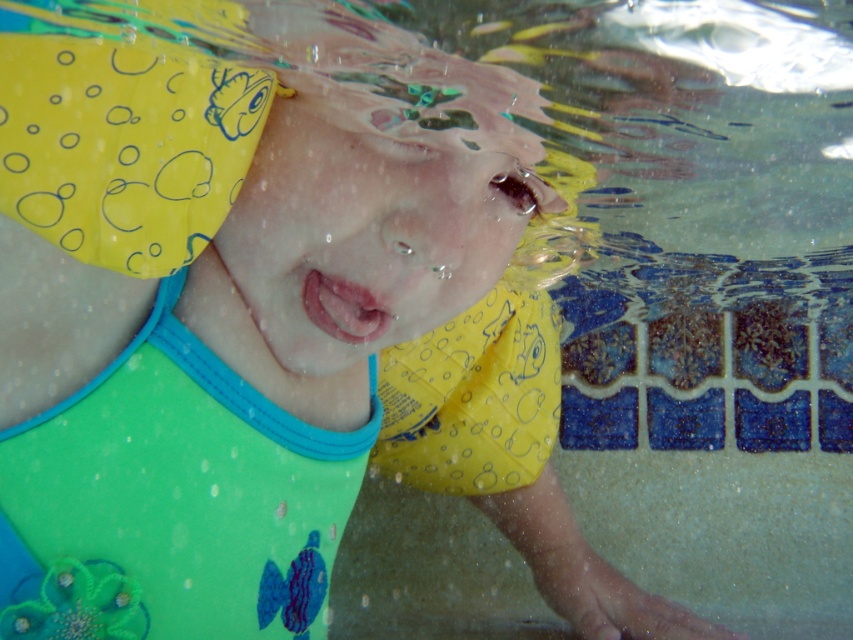
You are a lifeguard assessing the safety gear of a swimmer in the pool. The swimmer has a green fabric bib at center and a yellow rubbery swim cap at upper left. Which piece of gear is taller?

The green fabric bib at center is taller than the yellow rubbery swim cap at upper left according to the description.